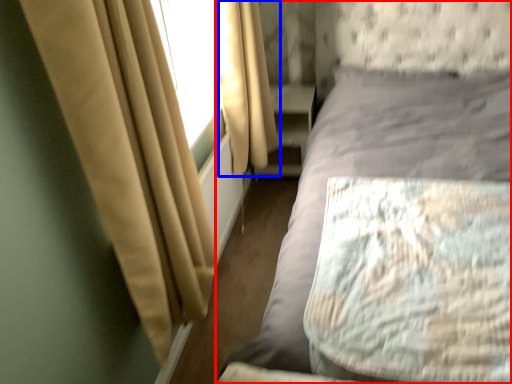
Question: Which object is closer to the camera taking this photo, bed (highlighted by a red box) or curtain (highlighted by a blue box)?

Choices:
 (A) bed
 (B) curtain

Answer: (A)